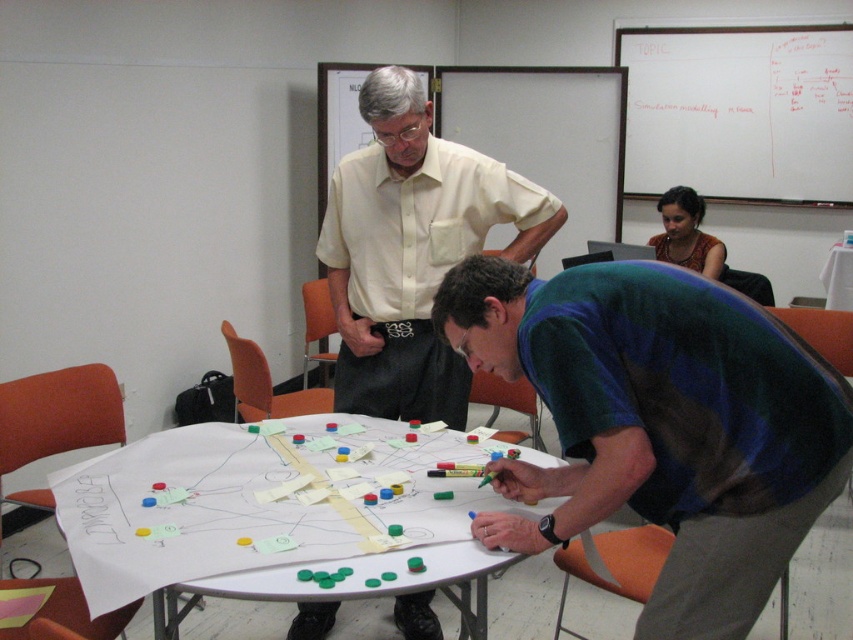
In the scene shown: You are standing in the classroom and see two points marked on the large sheet of paper on the table. Which point is closer to you, the point at coordinate [463,204] or the point at [775,125]?

The point at coordinate [463,204] is closer to you than the point at [775,125] because it is positioned closer in the image.

Where is the light beige shirt at center located in the image?

The light beige shirt at center is located at point (412, 250) in the image.